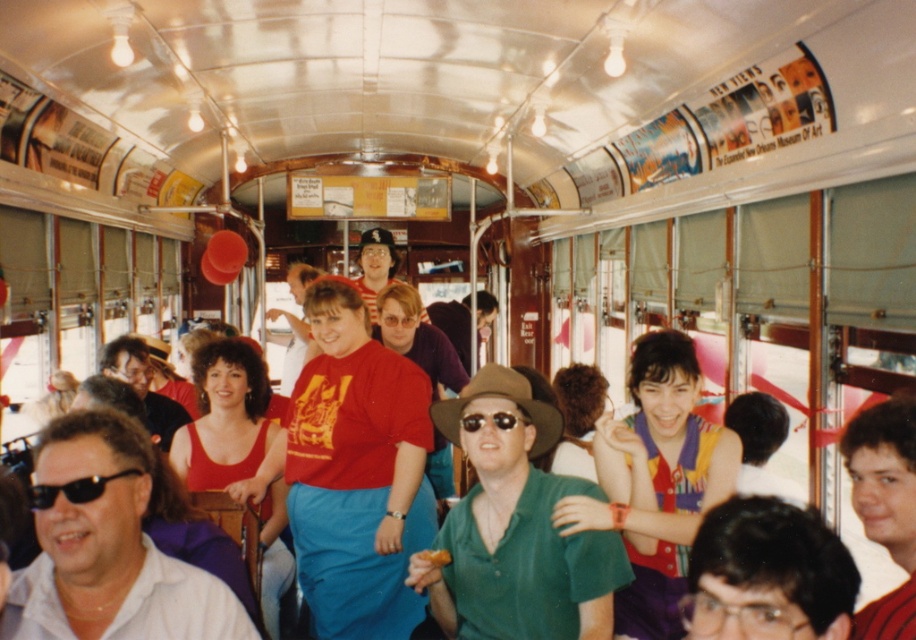
Question: Is green matte shirt at center below black plastic sunglasses at lower left?

Choices:
 (A) yes
 (B) no

Answer: (A)

Question: Among these points, which one is farthest from the camera?

Choices:
 (A) (826, 627)
 (B) (509, 428)
 (C) (99, 496)
 (D) (41, 438)

Answer: (B)

Question: From the image, what is the correct spatial relationship of green matte shirt at center in relation to black plastic sunglasses at lower left?

Choices:
 (A) above
 (B) below

Answer: (B)

Question: Which object is positioned farthest from the black plastic sunglasses at center?

Choices:
 (A) green matte shirt at center
 (B) black plastic sunglasses at lower left

Answer: (B)

Question: In this image, where is green matte shirt at center located relative to white matte shirt at lower left?

Choices:
 (A) below
 (B) above

Answer: (A)

Question: Among these points, which one is nearest to the camera?

Choices:
 (A) (104, 620)
 (B) (463, 422)
 (C) (100, 477)

Answer: (C)